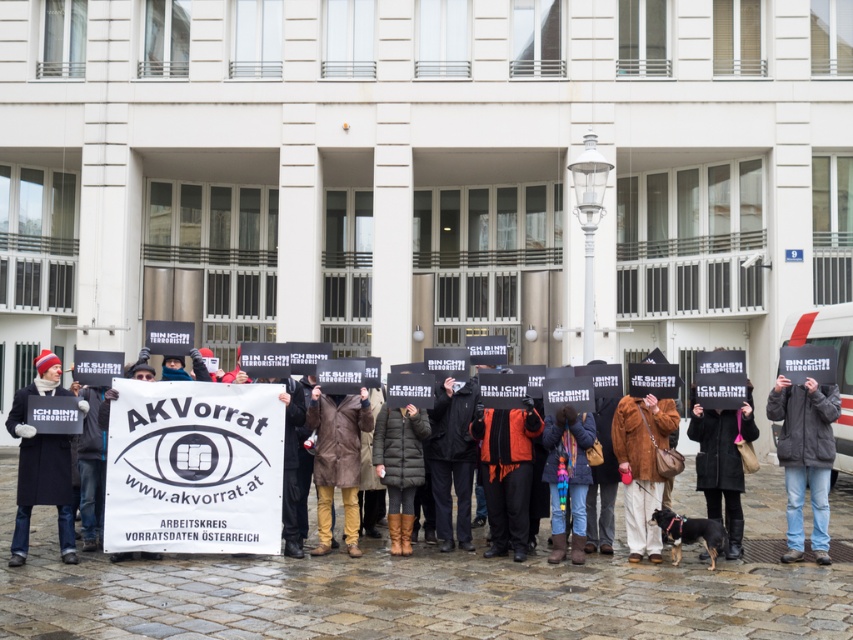
Is black matte coat at center to the left of dark brown leather coat at center from the viewer's perspective?

Correct, you'll find black matte coat at center to the left of dark brown leather coat at center.

Can you confirm if black matte coat at center is positioned above dark brown leather coat at center?

Correct, black matte coat at center is located above dark brown leather coat at center.

Locate an element on the screen. black matte coat at center is located at coordinates (190, 436).

Where is `black matte coat at center`? The height and width of the screenshot is (640, 853). black matte coat at center is located at coordinates (190, 436).

Between dark gray fleece jacket at center and multicolored knitted scarf at center, which one is positioned higher?

dark gray fleece jacket at center

Between dark gray fleece jacket at center and multicolored knitted scarf at center, which one appears on the right side from the viewer's perspective?

dark gray fleece jacket at center is more to the right.

Is point (799, 509) more distant than point (563, 433)?

Yes.

Identify the location of dark gray fleece jacket at center. (805, 456).

Which is more to the right, black matte coat at left or dark brown leather coat at center?

dark brown leather coat at center is more to the right.

Describe the element at coordinates (41, 465) in the screenshot. The image size is (853, 640). I see `black matte coat at left` at that location.

Image resolution: width=853 pixels, height=640 pixels. I want to click on black matte coat at left, so click(x=41, y=465).